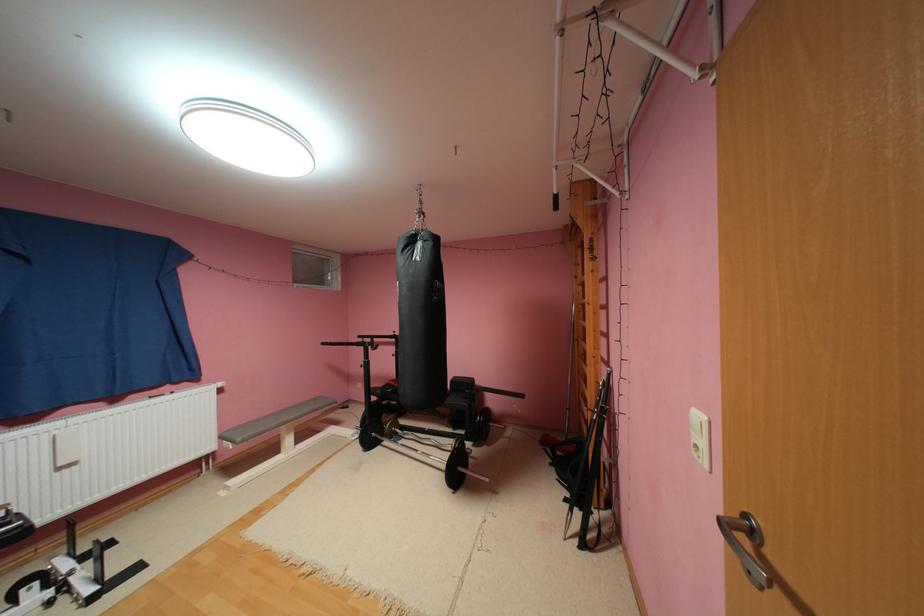
The height and width of the screenshot is (616, 924). Identify the location of grey bench surface. (274, 419).